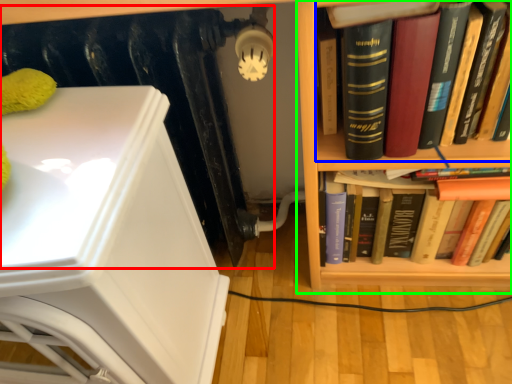
Question: Which object is positioned closest to radiator (highlighted by a red box)? Select from book (highlighted by a blue box) and bookcase (highlighted by a green box).

Choices:
 (A) book
 (B) bookcase

Answer: (B)